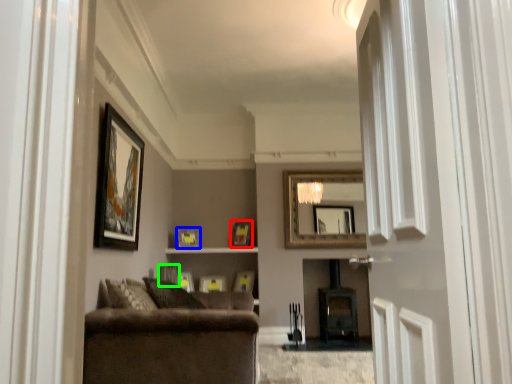
Question: Which object is the farthest from picture frame (highlighted by a red box)? Choose among these: picture frame (highlighted by a blue box) or picture frame (highlighted by a green box).

Choices:
 (A) picture frame
 (B) picture frame

Answer: (B)